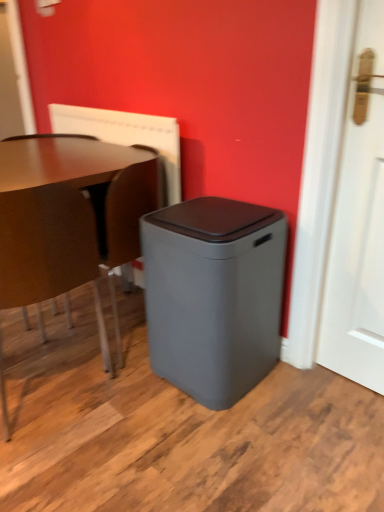
Where is `vacant area that is in front of gray matte waste container at center`? The height and width of the screenshot is (512, 384). vacant area that is in front of gray matte waste container at center is located at coordinates (225, 443).